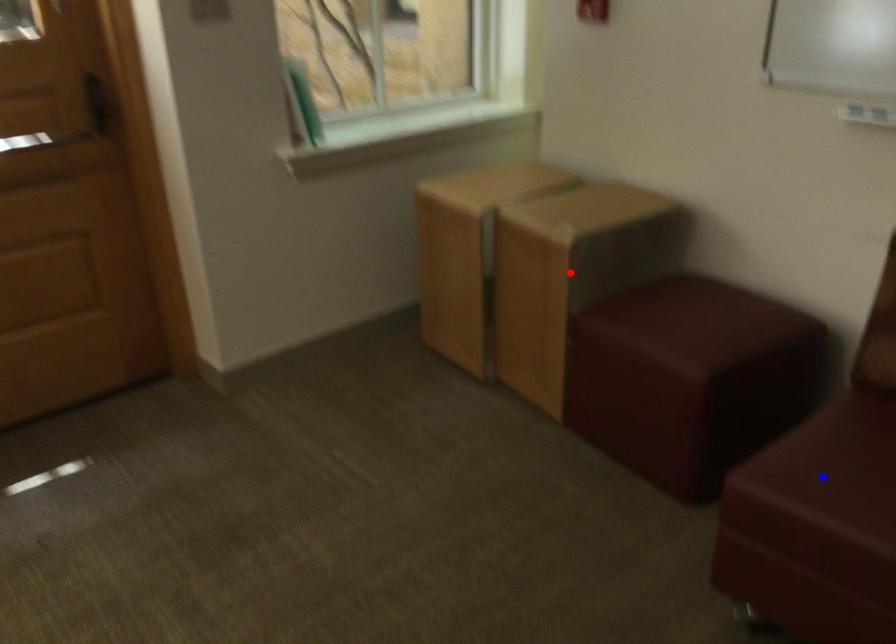
Question: Which of the two points in the image is closer to the camera?

Choices:
 (A) Blue point is closer.
 (B) Red point is closer.

Answer: (A)